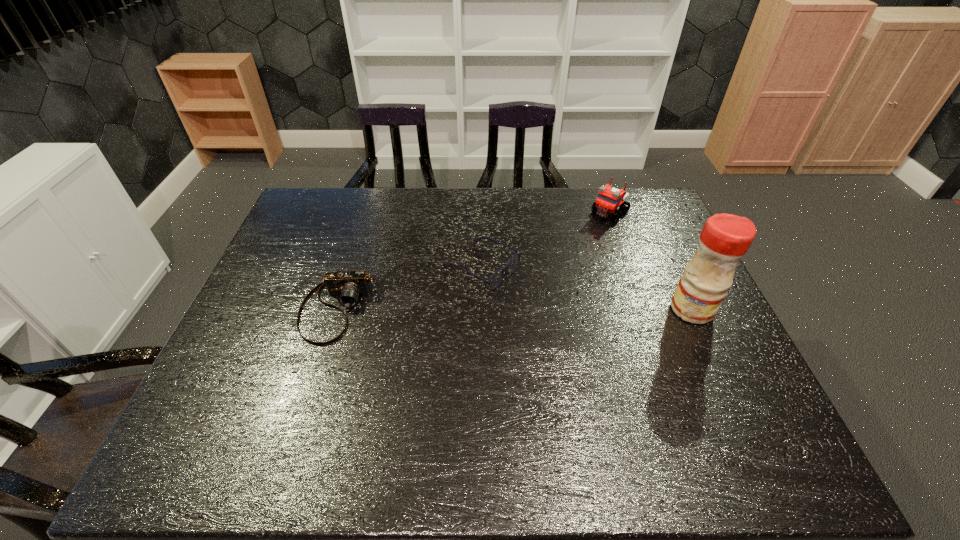
Locate an element on the screen. Image resolution: width=960 pixels, height=540 pixels. vacant space located on the front-facing side of the farthest object is located at coordinates (558, 260).

The height and width of the screenshot is (540, 960). Identify the location of free space located on the front-facing side of the farthest object. (531, 286).

This screenshot has height=540, width=960. In order to click on free space located on the front-facing side of the second object from left to right in this screenshot , I will do `click(540, 298)`.

The height and width of the screenshot is (540, 960). In order to click on vacant area located 0.380m on the front-facing side of the second object from left to right in this screenshot , I will do `click(638, 351)`.

Find the location of a particular element. This screenshot has width=960, height=540. free spot located 0.120m on the front-facing side of the second object from left to right is located at coordinates (549, 303).

You are a GUI agent. You are given a task and a screenshot of the screen. Output one action in this format:
    pyautogui.click(x=<x>, y=<y>)
    Task: Click on the object present at the far edge
    
    Given the screenshot: What is the action you would take?
    pyautogui.click(x=609, y=199)

Identify the location of object present at the left edge. (348, 286).

The height and width of the screenshot is (540, 960). In order to click on condiment that is at the right edge in this screenshot , I will do `click(725, 238)`.

The height and width of the screenshot is (540, 960). In order to click on Lego present at the right edge in this screenshot , I will do `click(609, 199)`.

You are a GUI agent. You are given a task and a screenshot of the screen. Output one action in this format:
    pyautogui.click(x=<x>, y=<y>)
    Task: Click on the object present at the far right corner
    The image size is (960, 540).
    Given the screenshot: What is the action you would take?
    pyautogui.click(x=609, y=199)